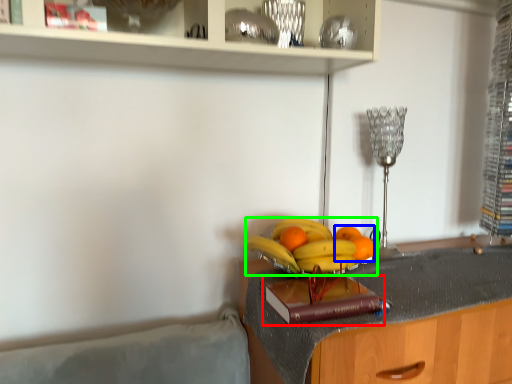
Question: Based on their relative distances, which object is nearer to book (highlighted by a red box)? Choose from citrus fruit (highlighted by a blue box) and banana (highlighted by a green box).

Choices:
 (A) citrus fruit
 (B) banana

Answer: (B)